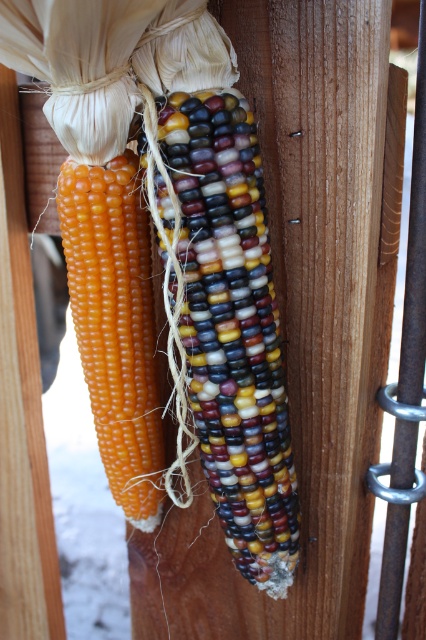
Question: Does multicolored polished corn at center appear over smooth yellow corn at left?

Choices:
 (A) yes
 (B) no

Answer: (B)

Question: Can you confirm if multicolored polished corn at center is positioned above smooth yellow corn at left?

Choices:
 (A) yes
 (B) no

Answer: (B)

Question: In this image, where is multicolored polished corn at center located relative to smooth yellow corn at left?

Choices:
 (A) above
 (B) below

Answer: (B)